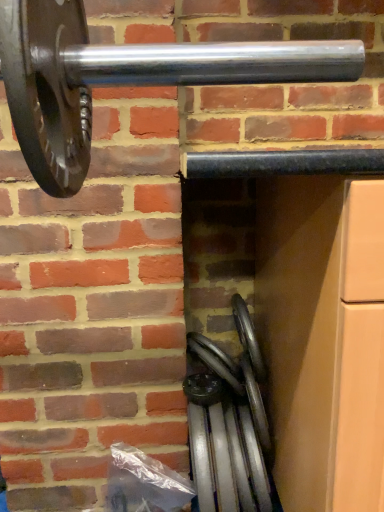
Question: Is polished silver wheel at lower center, which is counted as the 1th wheel, starting from the bottom, to the left or to the right of metallic silver wheel at lower center, the 1th wheel positioned from the top, in the image?

Choices:
 (A) right
 (B) left

Answer: (A)

Question: From a real-world perspective, is polished silver wheel at lower center, which is counted as the 1th wheel, starting from the bottom, positioned above or below metallic silver wheel at lower center, the 1th wheel positioned from the top?

Choices:
 (A) above
 (B) below

Answer: (B)

Question: From the image's perspective, is polished silver wheel at lower center, which is counted as the 2th wheel, starting from the top, positioned above or below metallic silver wheel at lower center, the 1th wheel positioned from the top?

Choices:
 (A) above
 (B) below

Answer: (B)

Question: Relative to polished silver wheel at lower center, which is counted as the 1th wheel, starting from the bottom, is metallic silver wheel at lower center, the 1th wheel positioned from the top, in front or behind?

Choices:
 (A) front
 (B) behind

Answer: (B)

Question: Is point (225, 373) closer or farther from the camera than point (211, 372)?

Choices:
 (A) closer
 (B) farther

Answer: (A)

Question: Looking at their shapes, would you say metallic silver wheel at lower center, the second wheel in the bottom-to-top sequence, is wider or thinner than polished silver wheel at lower center, which is counted as the 2th wheel, starting from the top?

Choices:
 (A) wide
 (B) thin

Answer: (B)

Question: Is metallic silver wheel at lower center, the 1th wheel positioned from the top, bigger or smaller than polished silver wheel at lower center, which is counted as the 2th wheel, starting from the top?

Choices:
 (A) big
 (B) small

Answer: (B)